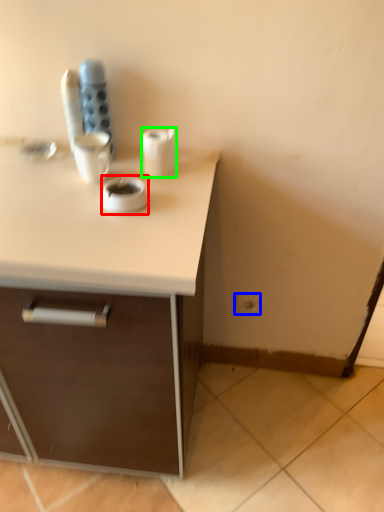
Question: Considering the real-world distances, which object is closest to coffee (highlighted by a red box)? electric outlet (highlighted by a blue box) or paper towel (highlighted by a green box).

Choices:
 (A) electric outlet
 (B) paper towel

Answer: (B)